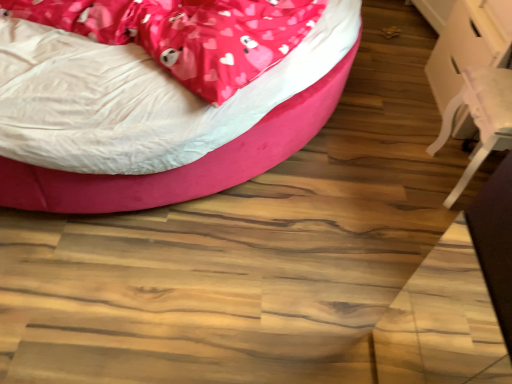
Question: Is pink satin blanket at upper left to the left or to the right of white glossy table at right in the image?

Choices:
 (A) right
 (B) left

Answer: (B)

Question: Considering the positions of pink satin blanket at upper left and white glossy table at right in the image, is pink satin blanket at upper left bigger or smaller than white glossy table at right?

Choices:
 (A) small
 (B) big

Answer: (B)

Question: Which object is positioned farthest from the velvet pink bed at upper left?

Choices:
 (A) pink satin blanket at upper left
 (B) white glossy table at right
 (C) white plastic swivel chair at right

Answer: (B)

Question: Considering the real-world distances, which object is farthest from the white plastic swivel chair at right?

Choices:
 (A) velvet pink bed at upper left
 (B) white glossy table at right
 (C) pink satin blanket at upper left

Answer: (C)